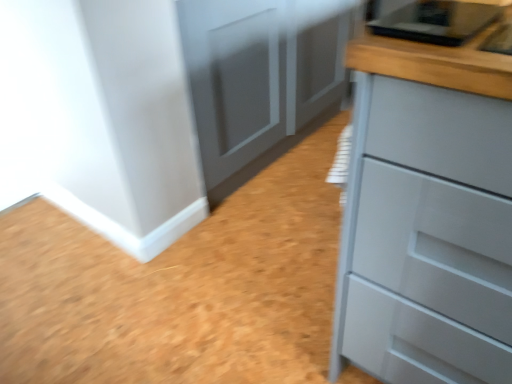
Question: Considering the positions of matte gray chest of drawers at right and matte gray cupboard at center in the image, is matte gray chest of drawers at right wider or thinner than matte gray cupboard at center?

Choices:
 (A) thin
 (B) wide

Answer: (B)

Question: Considering the positions of point (397, 259) and point (310, 119), is point (397, 259) closer or farther from the camera than point (310, 119)?

Choices:
 (A) closer
 (B) farther

Answer: (A)

Question: From a real-world perspective, is matte gray chest of drawers at right positioned above or below matte gray cupboard at center?

Choices:
 (A) above
 (B) below

Answer: (A)

Question: Looking at the image, does matte gray cupboard at center seem bigger or smaller compared to matte gray chest of drawers at right?

Choices:
 (A) big
 (B) small

Answer: (A)

Question: In terms of width, does matte gray cupboard at center look wider or thinner when compared to matte gray chest of drawers at right?

Choices:
 (A) thin
 (B) wide

Answer: (A)

Question: Is matte gray cupboard at center inside the boundaries of matte gray chest of drawers at right, or outside?

Choices:
 (A) inside
 (B) outside

Answer: (B)

Question: Is point (276, 110) closer or farther from the camera than point (376, 268)?

Choices:
 (A) closer
 (B) farther

Answer: (B)